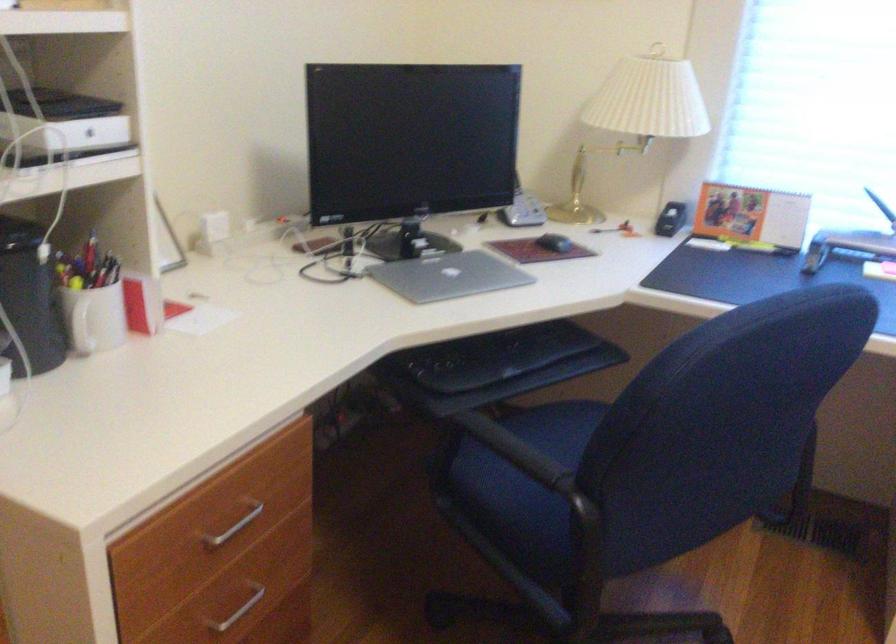
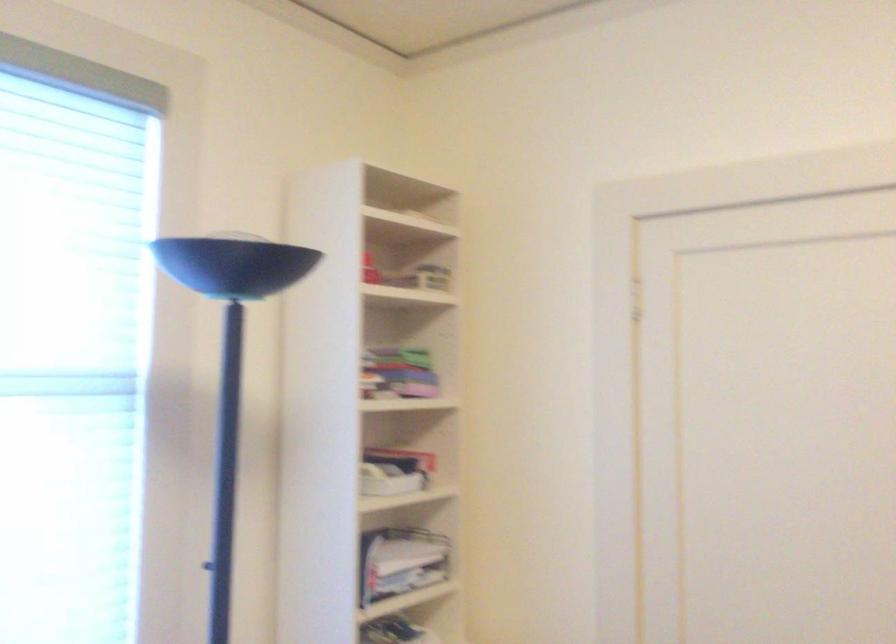
Question: The images are taken continuously from a first-person perspective. In which direction is your viewpoint rotating?

Choices:
 (A) Left
 (B) Right
 (C) Up
 (D) Down

Answer: (B)